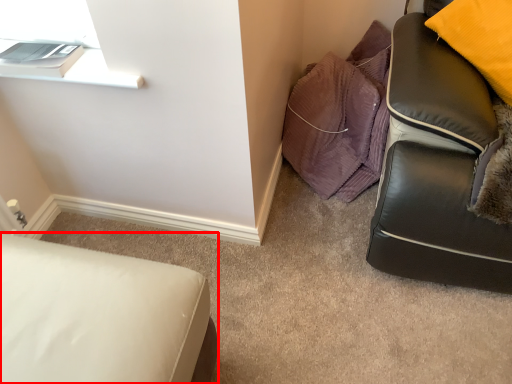
Question: In this image, where is furniture (annotated by the red box) located relative to material?

Choices:
 (A) left
 (B) right

Answer: (A)